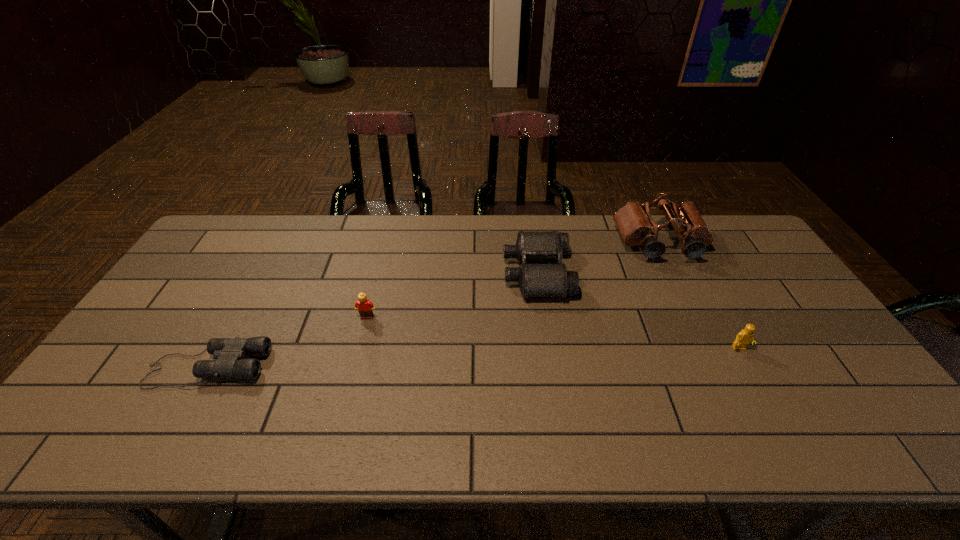
Find the location of a particular element. the tallest binoculars is located at coordinates (633, 220).

You are a GUI agent. You are given a task and a screenshot of the screen. Output one action in this format:
    pyautogui.click(x=<x>, y=<y>)
    Task: Click on the rightmost binoculars
    Image resolution: width=960 pixels, height=540 pixels.
    Given the screenshot: What is the action you would take?
    pyautogui.click(x=633, y=220)

Find the location of a particular element. This screenshot has width=960, height=540. the third object from right to left is located at coordinates (535, 280).

Locate an element on the screen. The width and height of the screenshot is (960, 540). the second tallest binoculars is located at coordinates (535, 280).

You are a GUI agent. You are given a task and a screenshot of the screen. Output one action in this format:
    pyautogui.click(x=<x>, y=<y>)
    Task: Click on the left Lego
    This screenshot has height=540, width=960.
    Given the screenshot: What is the action you would take?
    [x=365, y=307]

Where is `the third farthest object`? the third farthest object is located at coordinates (365, 307).

Where is `the right Lego`? the right Lego is located at coordinates (743, 338).

The height and width of the screenshot is (540, 960). I want to click on the leftmost binoculars, so click(229, 353).

This screenshot has width=960, height=540. Find the location of `the nearest binoculars`. the nearest binoculars is located at coordinates (229, 353).

Identify the location of vacant space located 0.050m through the eyepieces of the tallest binoculars. This screenshot has width=960, height=540. (675, 275).